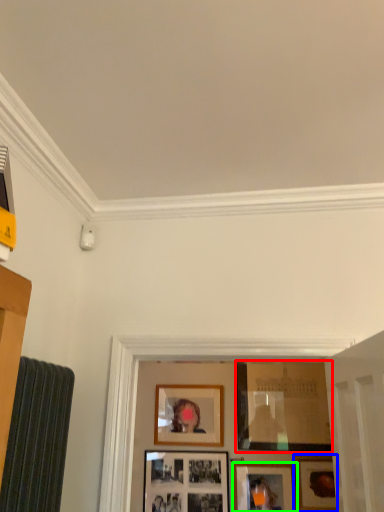
Question: Estimate the real-world distances between objects in this image. Which object is farther from picture frame (highlighted by a red box), picture frame (highlighted by a blue box) or picture frame (highlighted by a green box)?

Choices:
 (A) picture frame
 (B) picture frame

Answer: (B)